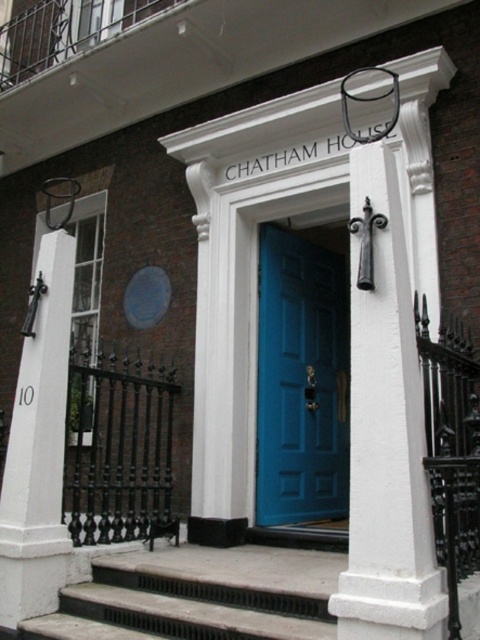
Which is in front, point (394, 413) or point (268, 339)?

Point (394, 413) is more forward.

Is white painted wood at center bigger than teal glossy door at center?

No.

What do you see at coordinates (386, 438) in the screenshot?
I see `white painted wood at center` at bounding box center [386, 438].

You are a GUI agent. You are given a task and a screenshot of the screen. Output one action in this format:
    pyautogui.click(x=<x>, y=<y>)
    Task: Click on the white painted wood at center
    The width and height of the screenshot is (480, 640).
    Given the screenshot: What is the action you would take?
    pyautogui.click(x=386, y=438)

Can you confirm if teal glossy door at center is positioned to the left of white stone post at left?

Incorrect, teal glossy door at center is not on the left side of white stone post at left.

Image resolution: width=480 pixels, height=640 pixels. In order to click on teal glossy door at center in this screenshot , I will do `click(300, 381)`.

This screenshot has width=480, height=640. In order to click on teal glossy door at center in this screenshot , I will do `click(300, 381)`.

Does white painted wood at center have a greater height compared to white stone post at left?

No.

Is point (420, 576) more distant than point (60, 490)?

No, (420, 576) is closer to viewer.

Locate an element on the screen. The width and height of the screenshot is (480, 640). white painted wood at center is located at coordinates (386, 438).